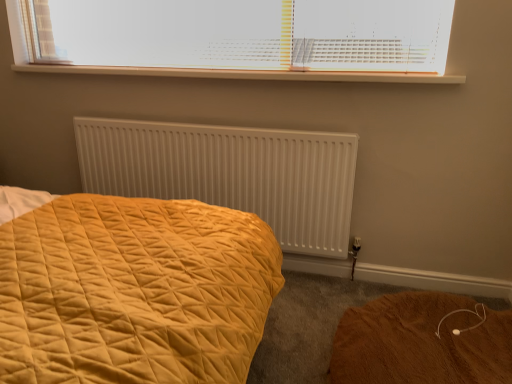
The height and width of the screenshot is (384, 512). Describe the element at coordinates (421, 342) in the screenshot. I see `brown fuzzy rug at lower right` at that location.

Image resolution: width=512 pixels, height=384 pixels. Identify the location of brown fuzzy rug at lower right. (421, 342).

Is white matte radiator at center positioned beyond the bounds of white plastic radiator at upper center?

That's correct, white matte radiator at center is outside of white plastic radiator at upper center.

Looking at this image, who is more distant, white matte radiator at center or white plastic radiator at upper center?

white matte radiator at center is more distant.

Is white matte radiator at center looking in the opposite direction of white plastic radiator at upper center?

white matte radiator at center is not turned away from white plastic radiator at upper center.

Considering the points (296, 174) and (20, 70), which point is in front, point (296, 174) or point (20, 70)?

The point (296, 174) is closer to the camera.

Which object is positioned more to the left, white plastic blinds at upper center or brown fuzzy rug at lower right?

white plastic blinds at upper center.

Can you confirm if white plastic blinds at upper center is shorter than brown fuzzy rug at lower right?

No.

Does white plastic blinds at upper center turn towards brown fuzzy rug at lower right?

No, white plastic blinds at upper center is not oriented towards brown fuzzy rug at lower right.

What's the angular difference between white plastic blinds at upper center and white plastic radiator at upper center's facing directions?

There is a 0.228-degree angle between the facing directions of white plastic blinds at upper center and white plastic radiator at upper center.

Which object is positioned more to the right, white plastic blinds at upper center or white plastic radiator at upper center?

Positioned to the right is white plastic radiator at upper center.

From a real-world perspective, is white plastic blinds at upper center beneath white plastic radiator at upper center?

No, from a real-world perspective, white plastic blinds at upper center is not beneath white plastic radiator at upper center.

The height and width of the screenshot is (384, 512). Find the location of `plain below the white matte radiator at center (from a real-world perspective)`. plain below the white matte radiator at center (from a real-world perspective) is located at coordinates (421, 342).

Which point is more distant from viewer, (473,341) or (310,213)?

The point (310,213) is more distant.

Are brown fuzzy rug at lower right and white matte radiator at center far apart?

No, brown fuzzy rug at lower right is in close proximity to white matte radiator at center.

Consider the image. Is white plastic radiator at upper center to the left of white plastic blinds at upper center from the viewer's perspective?

No.

Which object is wider, white plastic radiator at upper center or white plastic blinds at upper center?

white plastic radiator at upper center is wider.

Identify the location of window that is in front of the white plastic radiator at upper center. (207, 69).

Which object is closer to the camera, white plastic blinds at upper center or white matte radiator at center?

white plastic blinds at upper center is in front.

Considering the positions of objects white plastic blinds at upper center and white matte radiator at center in the image provided, who is more to the left, white plastic blinds at upper center or white matte radiator at center?

white matte radiator at center.

From the picture: In terms of width, does white plastic blinds at upper center look wider or thinner when compared to white matte radiator at center?

white plastic blinds at upper center is wider than white matte radiator at center.

Is white plastic blinds at upper center located outside white matte radiator at center?

That's correct, white plastic blinds at upper center is outside of white matte radiator at center.

What are the coordinates of `plain that is in front of the white plastic radiator at upper center` in the screenshot? It's located at (421, 342).

Can you confirm if white plastic radiator at upper center is smaller than brown fuzzy rug at lower right?

Indeed, white plastic radiator at upper center has a smaller size compared to brown fuzzy rug at lower right.

Is white plastic radiator at upper center in front of or behind brown fuzzy rug at lower right in the image?

white plastic radiator at upper center is behind brown fuzzy rug at lower right.

Is white plastic radiator at upper center not within brown fuzzy rug at lower right?

That's correct, white plastic radiator at upper center is outside of brown fuzzy rug at lower right.

Image resolution: width=512 pixels, height=384 pixels. I want to click on window sill above the white matte radiator at center (from the image's perspective), so click(247, 74).

Where is `plain on the right of white plastic blinds at upper center`? The height and width of the screenshot is (384, 512). plain on the right of white plastic blinds at upper center is located at coordinates (421, 342).

Looking at the image, which one is located further to brown fuzzy rug at lower right, white matte radiator at center or white plastic blinds at upper center?

Among the two, white plastic blinds at upper center is located further to brown fuzzy rug at lower right.

Based on their spatial positions, is white plastic blinds at upper center or white plastic radiator at upper center further from white matte radiator at center?

The object further to white matte radiator at center is white plastic blinds at upper center.

Based on the photo, which object lies nearer to the anchor point white matte radiator at center, brown fuzzy rug at lower right or white plastic blinds at upper center?

Among the two, white plastic blinds at upper center is located nearer to white matte radiator at center.

When comparing their distances from white plastic blinds at upper center, does white plastic radiator at upper center or white matte radiator at center seem closer?

white plastic radiator at upper center.

Considering their positions, is white matte radiator at center positioned further to white plastic radiator at upper center than brown fuzzy rug at lower right?

Based on the image, brown fuzzy rug at lower right appears to be further to white plastic radiator at upper center.

Which object lies nearer to the anchor point white plastic radiator at upper center, white plastic blinds at upper center or white matte radiator at center?

Based on the image, white plastic blinds at upper center appears to be nearer to white plastic radiator at upper center.

Considering their positions, is white matte radiator at center positioned closer to white plastic blinds at upper center than brown fuzzy rug at lower right?

white matte radiator at center lies closer to white plastic blinds at upper center than the other object.

Considering their positions, is white plastic blinds at upper center positioned further to brown fuzzy rug at lower right than white matte radiator at center?

Among the two, white plastic blinds at upper center is located further to brown fuzzy rug at lower right.

Find the location of `window sill that lies between white plastic blinds at upper center and white matte radiator at center from top to bottom`. window sill that lies between white plastic blinds at upper center and white matte radiator at center from top to bottom is located at coordinates (247, 74).

At what (x,y) coordinates should I click in order to perform the action: click on radiator between white plastic blinds at upper center and brown fuzzy rug at lower right vertically. Please return your answer as a coordinate pair (x, y). Looking at the image, I should click on (230, 173).

Image resolution: width=512 pixels, height=384 pixels. I want to click on radiator between white plastic radiator at upper center and brown fuzzy rug at lower right from top to bottom, so click(230, 173).

Where is `window sill that lies between white plastic blinds at upper center and brown fuzzy rug at lower right from top to bottom`? The image size is (512, 384). window sill that lies between white plastic blinds at upper center and brown fuzzy rug at lower right from top to bottom is located at coordinates (247, 74).